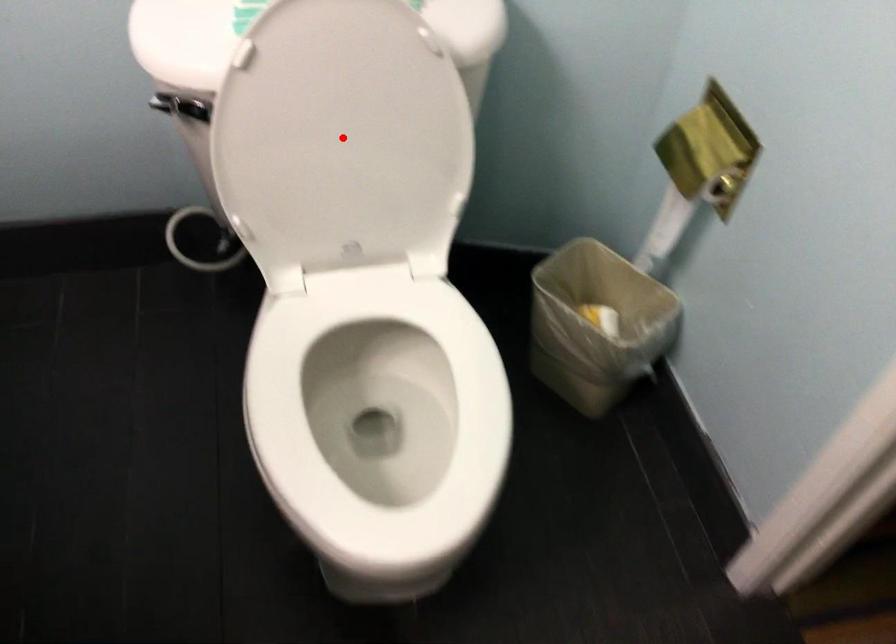
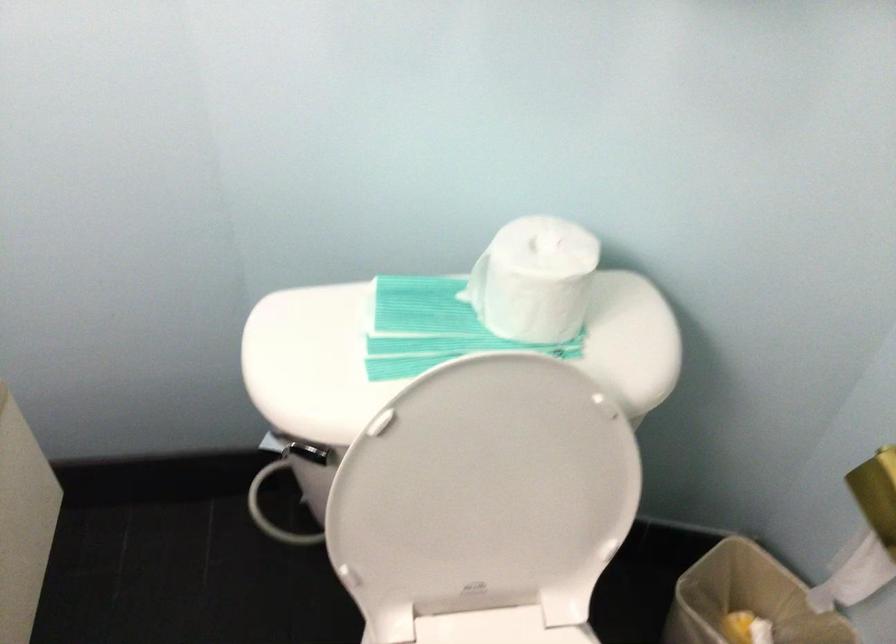
Find the pixel in the second image that matches the highlighted location in the first image.

(486, 496)